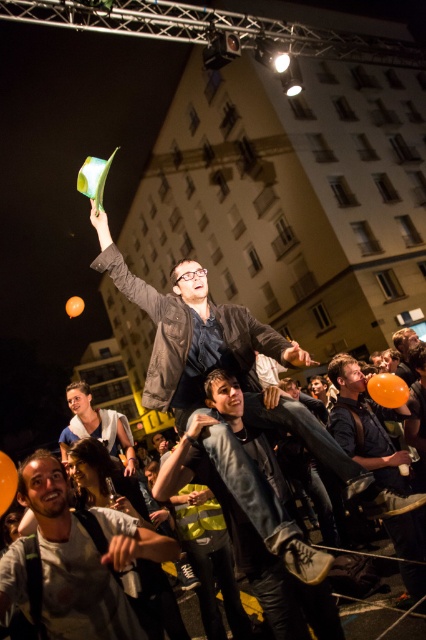
Question: Is matte gray t-shirt at center bigger than matte black jacket at center?

Choices:
 (A) no
 (B) yes

Answer: (A)

Question: Does matte black jacket at center have a larger size compared to light brown leather jacket at center?

Choices:
 (A) yes
 (B) no

Answer: (A)

Question: Which object is positioned closest to the orange matte balloon at upper center?

Choices:
 (A) matte black jacket at center
 (B) orange matte balloon at lower right

Answer: (B)

Question: Which point appears closest to the camera in this image?

Choices:
 (A) (258, 346)
 (B) (13, 486)

Answer: (B)

Question: Can you confirm if matte black jacket at center is positioned below light brown leather jacket at center?

Choices:
 (A) no
 (B) yes

Answer: (A)

Question: Which object is the farthest from the orange matte balloon at upper center?

Choices:
 (A) orange matte balloon at lower right
 (B) orange matte balloon at lower left
 (C) matte gray t-shirt at center
 (D) matte black shirt at lower right

Answer: (B)